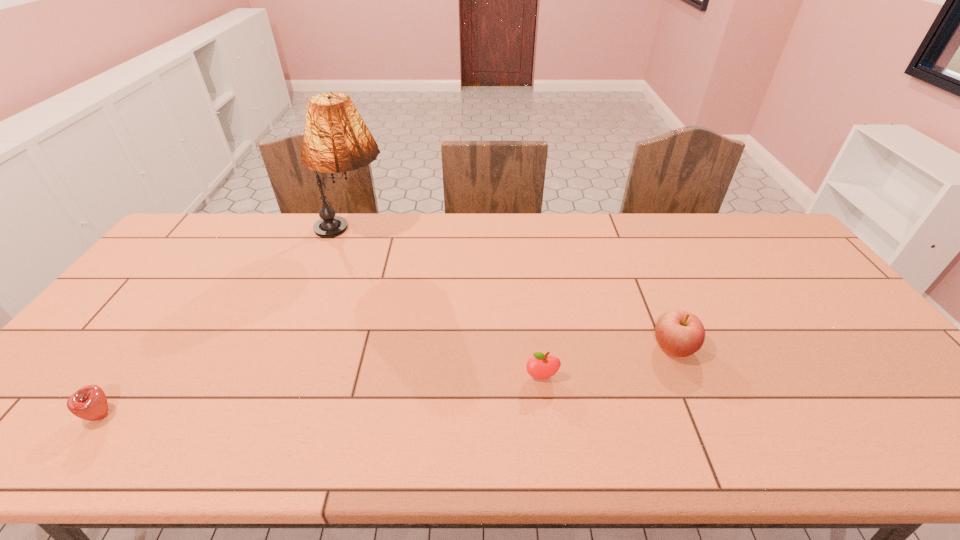
You are a GUI agent. You are given a task and a screenshot of the screen. Output one action in this format:
    pyautogui.click(x=<x>, y=<y>)
    Task: Click on the free space between the leftmost object and the second object from left to right
    This screenshot has height=540, width=960.
    Given the screenshot: What is the action you would take?
    pyautogui.click(x=227, y=324)

This screenshot has height=540, width=960. What are the coordinates of `object that is the second closest to the leftmost apple` in the screenshot? It's located at (541, 366).

This screenshot has height=540, width=960. Find the location of `object identified as the closest to the leftmost object`. object identified as the closest to the leftmost object is located at coordinates (336, 139).

Select which apple appears as the closest to the leftmost object. Please provide its 2D coordinates. Your answer should be formatted as a tuple, i.e. [(x, y)], where the tuple contains the x and y coordinates of a point satisfying the conditions above.

[(541, 366)]

The width and height of the screenshot is (960, 540). Find the location of `apple that stands as the second closest to the rightmost object`. apple that stands as the second closest to the rightmost object is located at coordinates (90, 403).

You are a GUI agent. You are given a task and a screenshot of the screen. Output one action in this format:
    pyautogui.click(x=<x>, y=<y>)
    Task: Click on the free point that satisfies the following two spatial constraints: 1. on the back side of the rightmost apple; 2. on the front-facing side of the tallest object
    
    Given the screenshot: What is the action you would take?
    pyautogui.click(x=625, y=233)

I want to click on vacant space that satisfies the following two spatial constraints: 1. on the front-facing side of the tallest object; 2. on the back side of the second nearest apple, so click(x=299, y=377).

Where is `free location that satisfies the following two spatial constraints: 1. on the front-facing side of the third farthest object; 2. on the left side of the lampshade`? The width and height of the screenshot is (960, 540). free location that satisfies the following two spatial constraints: 1. on the front-facing side of the third farthest object; 2. on the left side of the lampshade is located at coordinates (299, 377).

This screenshot has width=960, height=540. What are the coordinates of `vacant region that satisfies the following two spatial constraints: 1. on the front-facing side of the second tallest object; 2. on the right side of the tallest object` in the screenshot? It's located at (309, 348).

The height and width of the screenshot is (540, 960). I want to click on vacant space that satisfies the following two spatial constraints: 1. on the back side of the second apple from left to right; 2. on the right side of the second farthest object, so (538, 348).